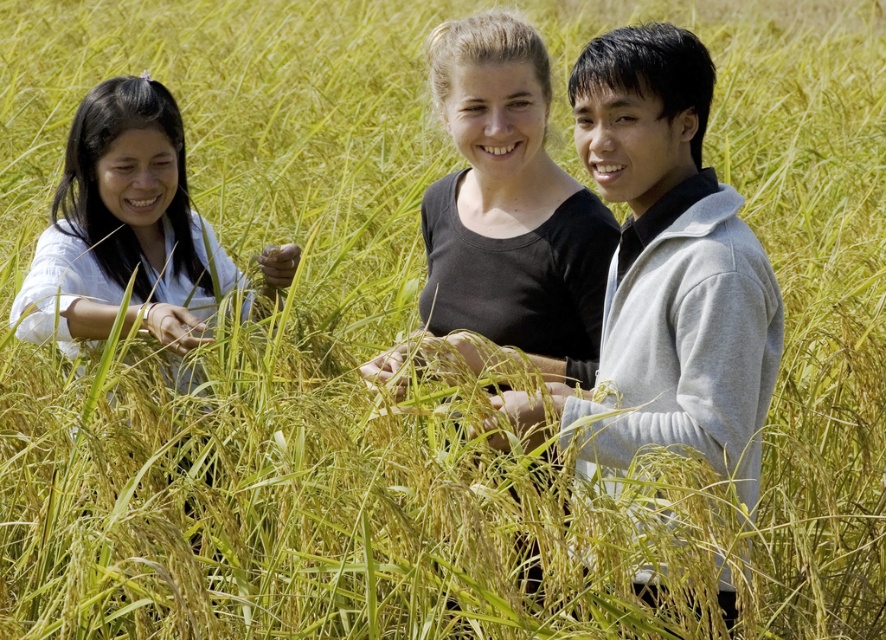
Does black matte shirt at center appear on the right side of light blue fabric at left?

Yes, black matte shirt at center is to the right of light blue fabric at left.

Between point (448, 225) and point (149, 140), which one is positioned behind?

Point (149, 140)

Is point (523, 129) positioned before point (196, 237)?

Yes, point (523, 129) is in front of point (196, 237).

The height and width of the screenshot is (640, 886). I want to click on black matte shirt at center, so click(510, 205).

Does gray fleece jacket at center have a greater height compared to light blue fabric at left?

Yes, gray fleece jacket at center is taller than light blue fabric at left.

Describe the element at coordinates (670, 266) in the screenshot. I see `gray fleece jacket at center` at that location.

The image size is (886, 640). Find the location of `gray fleece jacket at center`. gray fleece jacket at center is located at coordinates 670,266.

Does gray fleece jacket at center have a greater height compared to black matte shirt at center?

Yes, gray fleece jacket at center is taller than black matte shirt at center.

Can you confirm if gray fleece jacket at center is shorter than black matte shirt at center?

No.

This screenshot has height=640, width=886. What do you see at coordinates (670, 266) in the screenshot? I see `gray fleece jacket at center` at bounding box center [670, 266].

Where is `gray fleece jacket at center`? gray fleece jacket at center is located at coordinates (670, 266).